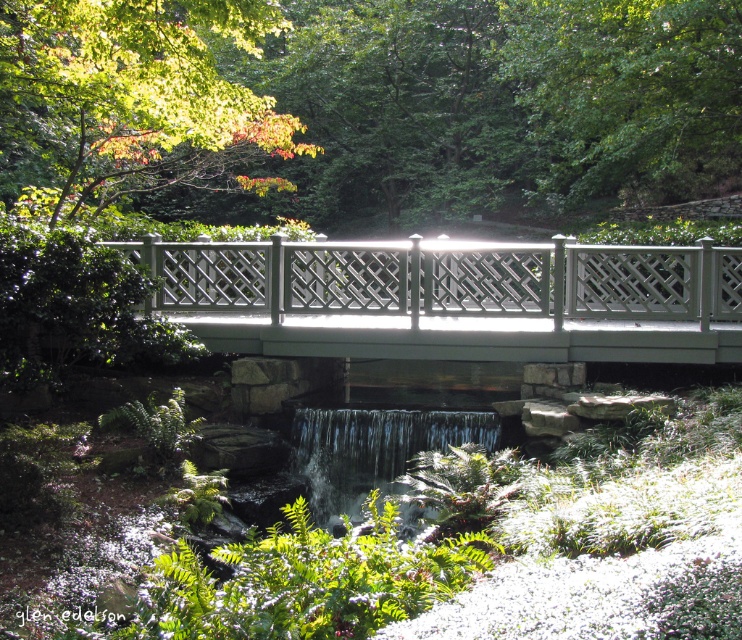
Does white lattice bridge at center appear under clear glass waterfall at center?

Actually, white lattice bridge at center is above clear glass waterfall at center.

Which is below, white lattice bridge at center or clear glass waterfall at center?

clear glass waterfall at center is below.

What do you see at coordinates (453, 298) in the screenshot? I see `white lattice bridge at center` at bounding box center [453, 298].

The image size is (742, 640). I want to click on white lattice bridge at center, so click(x=453, y=298).